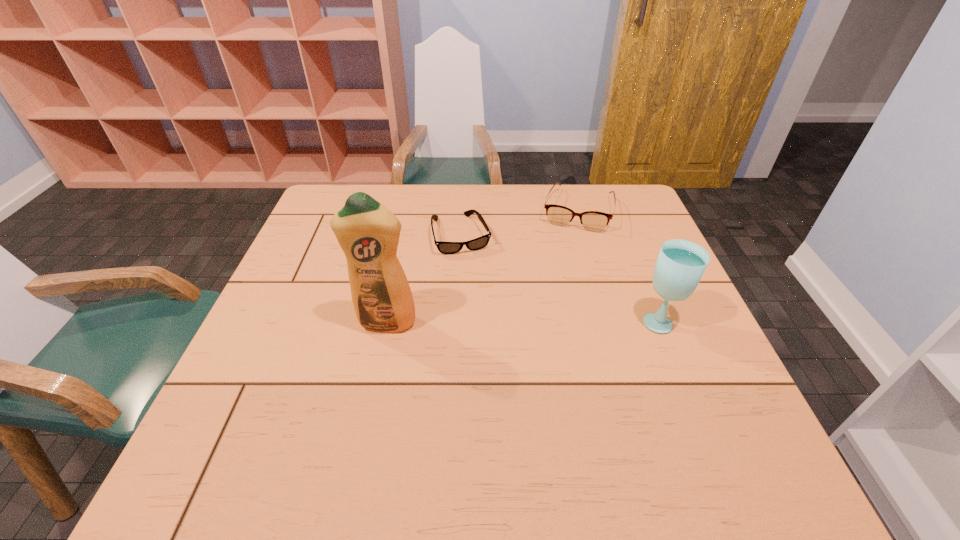
This screenshot has width=960, height=540. I want to click on free location located 0.300m on the front-facing side of the second object from left to right, so click(x=497, y=338).

The height and width of the screenshot is (540, 960). Identify the location of vacant region located on the face of the third tallest object. (563, 271).

Where is `free point located on the face of the third tallest object`? free point located on the face of the third tallest object is located at coordinates (555, 298).

Image resolution: width=960 pixels, height=540 pixels. What are the coordinates of `blank space located on the face of the third tallest object` in the screenshot? It's located at (564, 261).

This screenshot has height=540, width=960. What are the coordinates of `sunglasses positioned at the far edge` in the screenshot? It's located at (478, 243).

At what (x,y) coordinates should I click in order to perform the action: click on spectacles at the far edge. Please return your answer as a coordinate pair (x, y). This screenshot has width=960, height=540. Looking at the image, I should click on (594, 221).

Identify the location of glass positioned at the right edge. (680, 265).

You are a GUI agent. You are given a task and a screenshot of the screen. Output one action in this format:
    pyautogui.click(x=<x>, y=<y>)
    Task: Click on the spectacles at the right edge
    
    Given the screenshot: What is the action you would take?
    [x=594, y=221]

Locate an element on the screen. object that is at the far right corner is located at coordinates (594, 221).

In the image, there is a desktop. Identify the location of free region at the far edge. This screenshot has width=960, height=540. (522, 212).